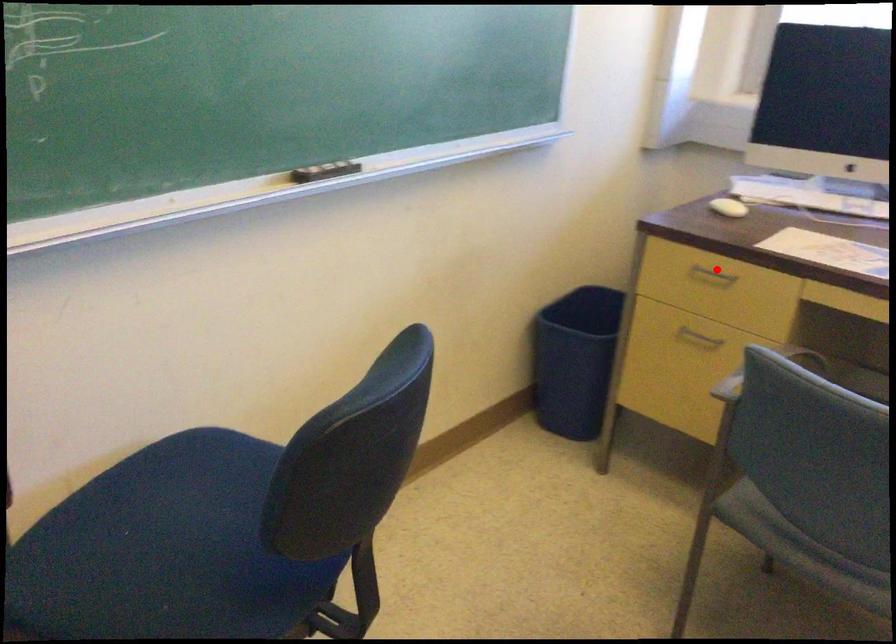
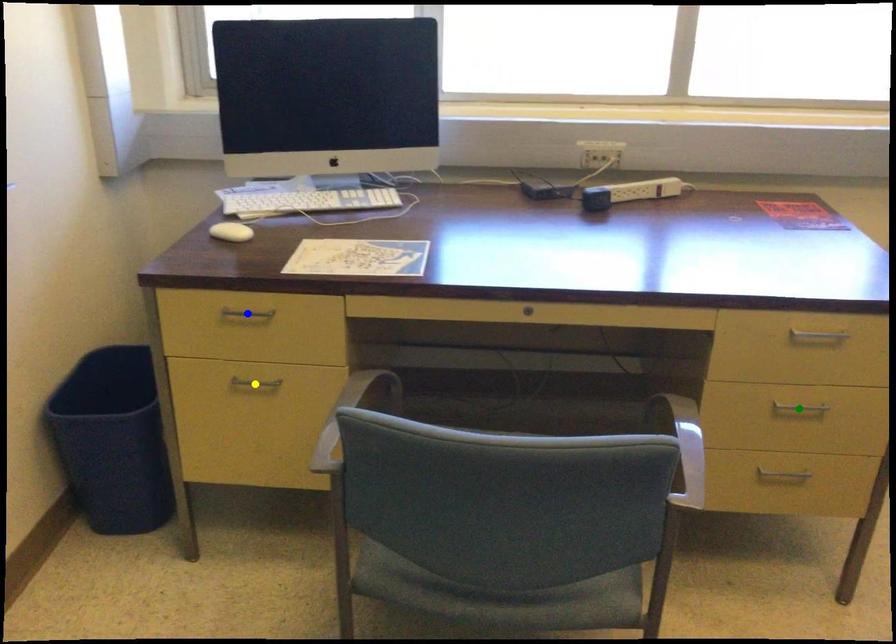
Question: I am providing you with two images of the same scene from different viewpoints. A red point is marked on the first image. You are given multiple points on the second image. In image 2, which mark is for the same physical point as the one in image 1?

Choices:
 (A) yellow point
 (B) blue point
 (C) green point

Answer: (B)